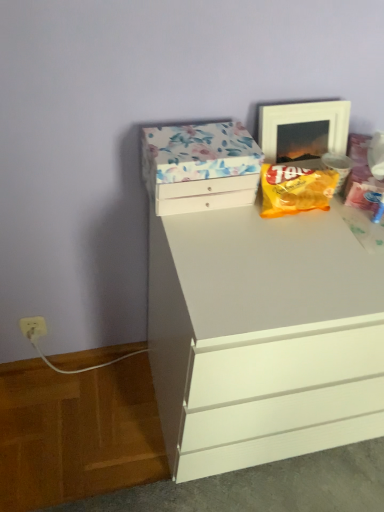
Where is `free space that is to the left of white matte chest of drawers at center`? This screenshot has height=512, width=384. free space that is to the left of white matte chest of drawers at center is located at coordinates (89, 418).